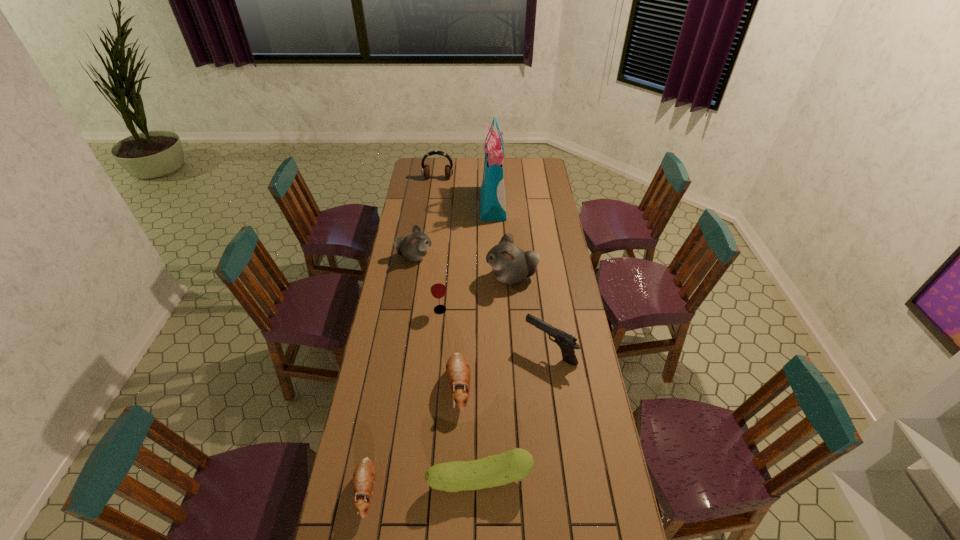
Find the location of a particular element. hamster at the right edge is located at coordinates (510, 264).

This screenshot has height=540, width=960. Identify the location of gun that is at the right edge. (567, 343).

Identify the location of object present at the far left corner. (425, 171).

Where is `vacant space at the left edge of the desktop`? This screenshot has width=960, height=540. vacant space at the left edge of the desktop is located at coordinates (340, 518).

You are a GUI agent. You are given a task and a screenshot of the screen. Output one action in this format:
    pyautogui.click(x=<x>, y=<y>)
    Task: Click on the vacant region at the right edge of the desktop
    
    Given the screenshot: What is the action you would take?
    pyautogui.click(x=537, y=230)

You are a GUI agent. You are given a task and a screenshot of the screen. Output one action in this format:
    pyautogui.click(x=<x>, y=<y>)
    Task: Click on the vacant area that lies between the second shortest hamster and the tallest object
    This screenshot has width=960, height=540.
    Given the screenshot: What is the action you would take?
    pyautogui.click(x=476, y=295)

Where is `empty location between the bigger brown hamster and the cucumber`? This screenshot has height=540, width=960. empty location between the bigger brown hamster and the cucumber is located at coordinates (469, 433).

Where is `vacant region between the second tallest hamster and the second farthest object`? This screenshot has height=540, width=960. vacant region between the second tallest hamster and the second farthest object is located at coordinates (454, 231).

Identify the location of vacant area that lies between the right brown hamster and the red glass. The height and width of the screenshot is (540, 960). (449, 348).

Where is `free point between the black gun and the fifth nearest object`? This screenshot has height=540, width=960. free point between the black gun and the fifth nearest object is located at coordinates (495, 330).